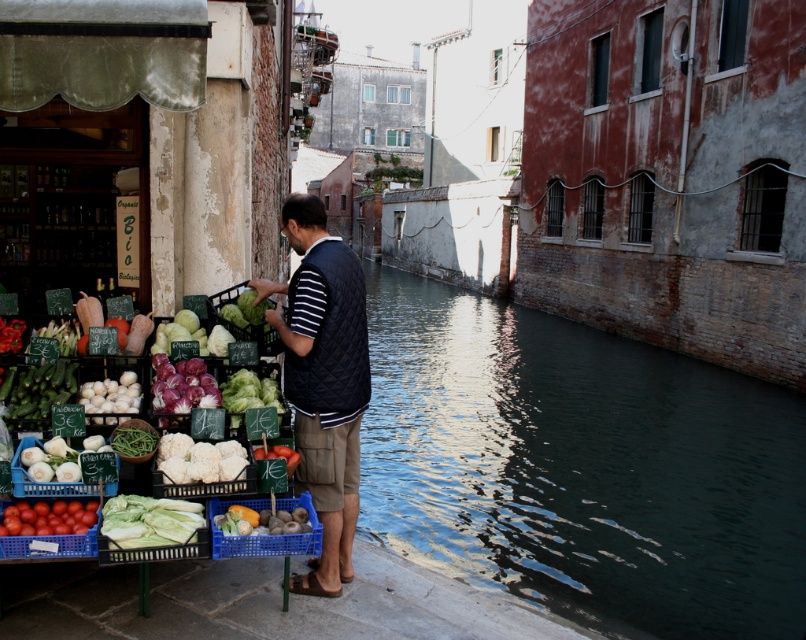
Is dark blue quilted vest at center above white matte onions at left?

Incorrect, dark blue quilted vest at center is not positioned above white matte onions at left.

Is dark blue quilted vest at center bigger than white matte onions at left?

Indeed, dark blue quilted vest at center has a larger size compared to white matte onions at left.

You are a GUI agent. You are given a task and a screenshot of the screen. Output one action in this format:
    pyautogui.click(x=<x>, y=<y>)
    Task: Click on the dark blue quilted vest at center
    The height and width of the screenshot is (640, 806).
    Given the screenshot: What is the action you would take?
    (323, 380)

Does point (345, 449) lie behind point (277, 444)?

Yes, point (345, 449) is behind point (277, 444).

Which of these two, dark blue quilted vest at center or smooth red tomato at center, stands taller?

Standing taller between the two is dark blue quilted vest at center.

Does point (347, 497) come farther from viewer compared to point (275, 444)?

That is True.

The image size is (806, 640). I want to click on dark blue quilted vest at center, so click(x=323, y=380).

Which is in front, point (576, 352) or point (269, 384)?

Point (269, 384)

Is point (462, 452) positioned after point (231, 394)?

Yes, point (462, 452) is farther from viewer.

Image resolution: width=806 pixels, height=640 pixels. I want to click on dark green water at canal center, so click(x=580, y=467).